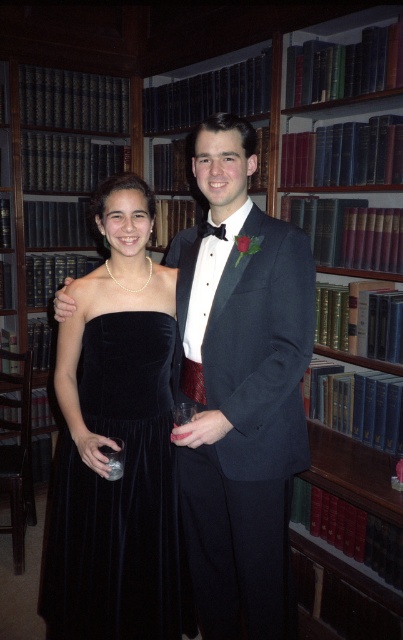
Question: Which object is closer to the camera taking this photo?

Choices:
 (A) black satin bow tie at center
 (B) black hardcover books at left
 (C) velvet black dress at center
 (D) hardcover books at center

Answer: (C)

Question: Among these points, which one is nearest to the camera?

Choices:
 (A) (74, 74)
 (B) (209, 228)
 (C) (355, 32)
 (D) (97, 573)

Answer: (B)

Question: Does hardcover books at center appear over black hardcover books at left?

Choices:
 (A) yes
 (B) no

Answer: (B)

Question: Can you confirm if velvet black dress at center is bigger than black hardcover books at left?

Choices:
 (A) no
 (B) yes

Answer: (A)

Question: Does shiny black suit at center have a larger size compared to black hardcover books at left?

Choices:
 (A) yes
 (B) no

Answer: (B)

Question: Which point is closer to the camera?

Choices:
 (A) (143, 637)
 (B) (257, 224)

Answer: (B)